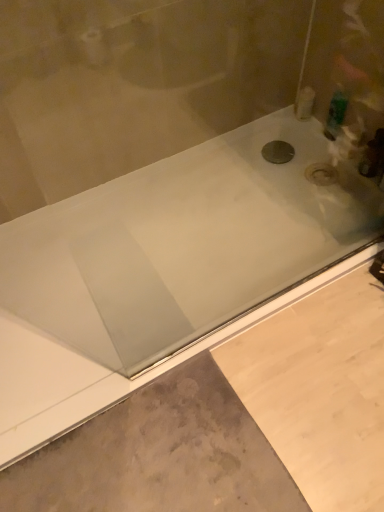
Where is `vacant region to the left of green plastic bottle at upper right, which is the first toiletry in right-to-left order`? vacant region to the left of green plastic bottle at upper right, which is the first toiletry in right-to-left order is located at coordinates (284, 136).